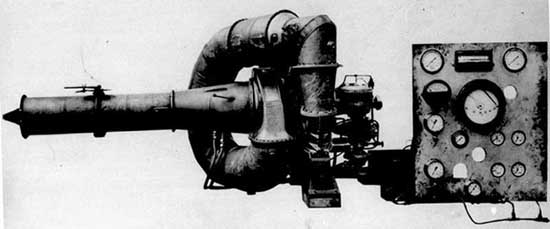
I want to click on empty space above status board, so click(476, 24).